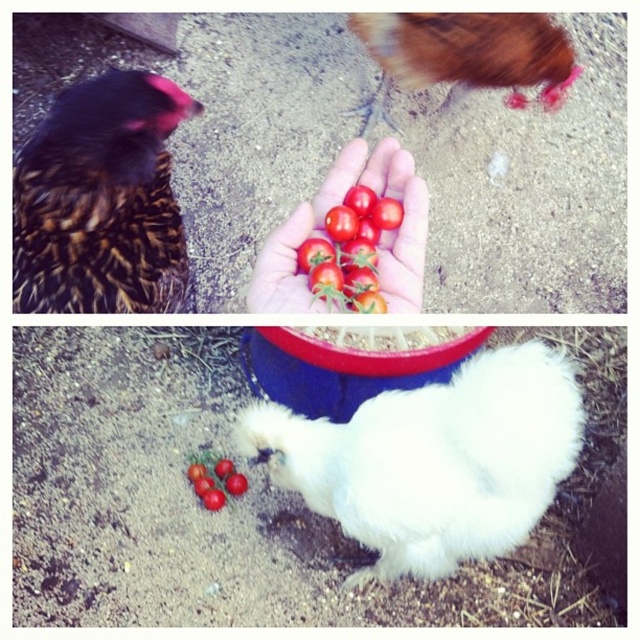
You are a photographer trying to capture both the brown speckled feathers at left and the brown fluffy chicken at upper center in a single shot. Which object is closer to your camera lens?

The brown speckled feathers at left are closer to the viewer, so they would be closer to the camera lens than the brown fluffy chicken at upper center.

You are a photographer standing 1.5 meters away from the white fluffy chicken at lower center. You want to take a photo of it. Can you get close enough to take a clear photo without moving the chicken?

The white fluffy chicken at lower center is 1.09 meters from camera. Since you are standing 1.5 meters away from it, you are 0.41 meters farther than the required distance. To take a clear photo, you need to move 0.41 meters closer to the white fluffy chicken at lower center.